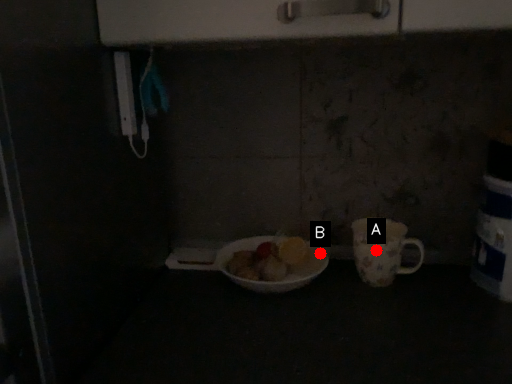
Question: Two points are circled on the image, labeled by A and B beside each circle. Which of the following is the farthest from the observer?

Choices:
 (A) A is further
 (B) B is further

Answer: (B)